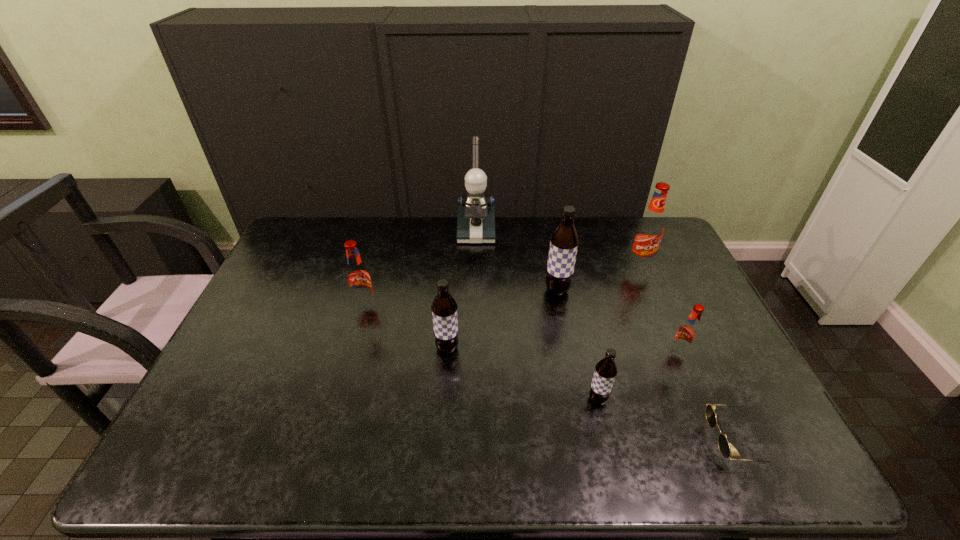
Locate an element on the screen. The width and height of the screenshot is (960, 540). vacant region between the farthest red root beer and the second biggest red root beer is located at coordinates (502, 285).

Identify the location of free space between the gray microscope and the leftmost root beer. The image size is (960, 540). (420, 268).

Find the location of a particular element. The height and width of the screenshot is (540, 960). vacant area that lies between the farthest red root beer and the leftmost root beer is located at coordinates (502, 285).

In order to click on the sixth closest object relative to the farthest red root beer in this screenshot , I will do [x=444, y=308].

Where is `object that is the closest to the nearest red root beer`? object that is the closest to the nearest red root beer is located at coordinates (723, 444).

Locate which root beer ranks fifth in proximity to the sunglasses. Please provide its 2D coordinates. Your answer should be formatted as a tuple, i.e. [(x, y)], where the tuple contains the x and y coordinates of a point satisfying the conditions above.

[(444, 308)]

Identify which root beer is the second closest to the farthest object. Please provide its 2D coordinates. Your answer should be formatted as a tuple, i.e. [(x, y)], where the tuple contains the x and y coordinates of a point satisfying the conditions above.

[(358, 279)]

Identify which red root beer is the second nearest to the smallest red root beer. Please provide its 2D coordinates. Your answer should be formatted as a tuple, i.e. [(x, y)], where the tuple contains the x and y coordinates of a point satisfying the conditions above.

[(358, 279)]

Select which red root beer is the closest to the gray microscope. Please provide its 2D coordinates. Your answer should be formatted as a tuple, i.e. [(x, y)], where the tuple contains the x and y coordinates of a point satisfying the conditions above.

[(358, 279)]

What are the coordinates of `brown root beer that is the closest to the farthest object` in the screenshot? It's located at (564, 241).